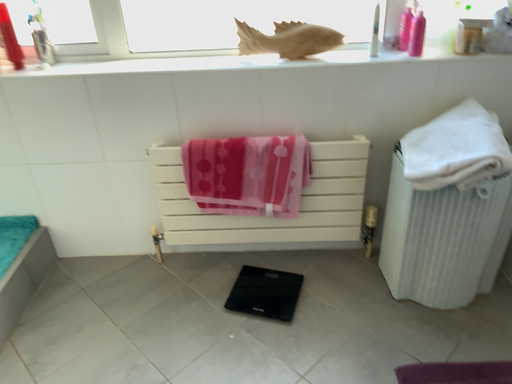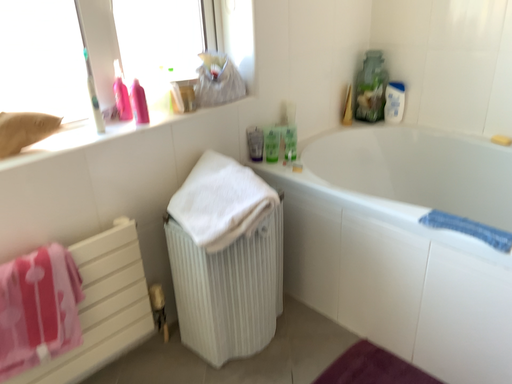
Question: Which way did the camera rotate in the video?

Choices:
 (A) rotated upward
 (B) rotated downward

Answer: (A)